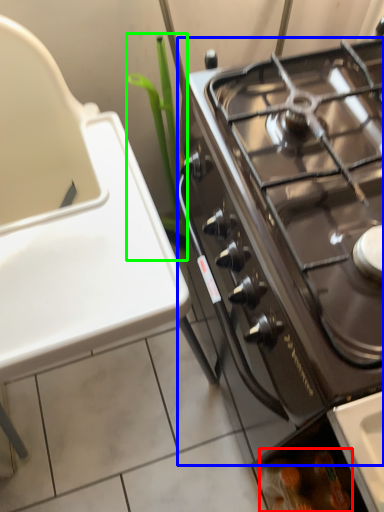
Question: Which object is the closest to the food (highlighted by a red box)? Choose among these: gas stove (highlighted by a blue box) or plant (highlighted by a green box).

Choices:
 (A) gas stove
 (B) plant

Answer: (A)